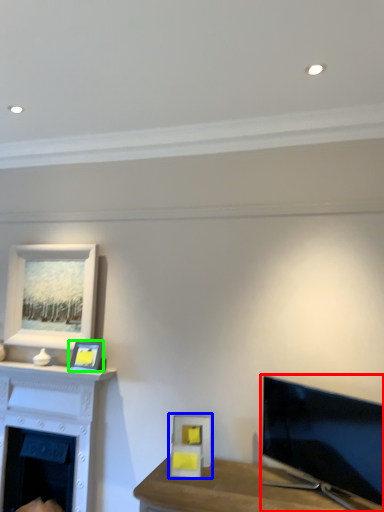
Question: Which is nearer to the television (highlighted by a red box)? picture frame (highlighted by a blue box) or picture frame (highlighted by a green box).

Choices:
 (A) picture frame
 (B) picture frame

Answer: (A)